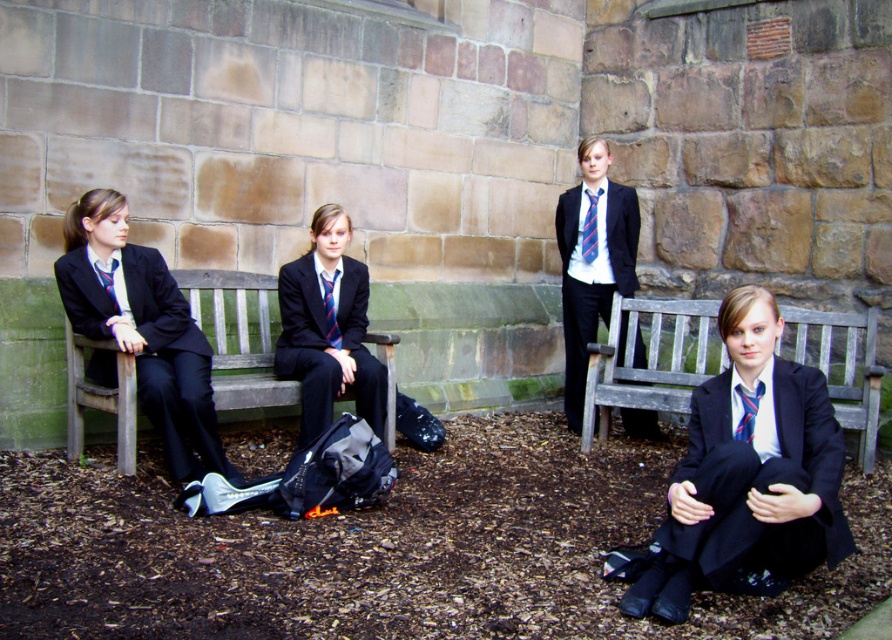
Which is in front, point (806, 490) or point (79, 426)?

Point (806, 490) is more forward.

Is matte black suit at lower right thinner than green wooden bench at left?

Correct, matte black suit at lower right's width is less than green wooden bench at left's.

Where is `matte black suit at lower right`? matte black suit at lower right is located at coordinates (758, 483).

Locate an element on the screen. Image resolution: width=892 pixels, height=640 pixels. matte black suit at lower right is located at coordinates (x=758, y=483).

Who is positioned more to the left, wooden park bench at lower right or blue striped tie at lower right?

blue striped tie at lower right is more to the left.

Which is above, wooden park bench at lower right or blue striped tie at lower right?

wooden park bench at lower right is above.

Who is more distant from viewer, (860, 388) or (736, 392)?

The point (860, 388) is behind.

Where is `wooden park bench at lower right`? The width and height of the screenshot is (892, 640). wooden park bench at lower right is located at coordinates (651, 358).

Identify the location of matte black suit at lower right. (758, 483).

Is matte black suit at lower right to the left of matte blue tie at left from the viewer's perspective?

In fact, matte black suit at lower right is to the right of matte blue tie at left.

Is point (698, 566) farther from viewer compared to point (98, 262)?

No.

The image size is (892, 640). Identify the location of matte black suit at lower right. (758, 483).